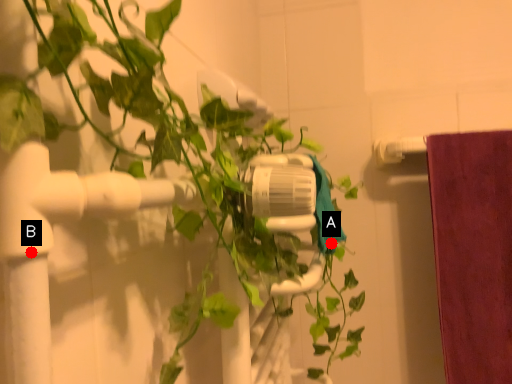
Question: Two points are circled on the image, labeled by A and B beside each circle. Which of the following is the farthest from the observer?

Choices:
 (A) A is further
 (B) B is further

Answer: (A)